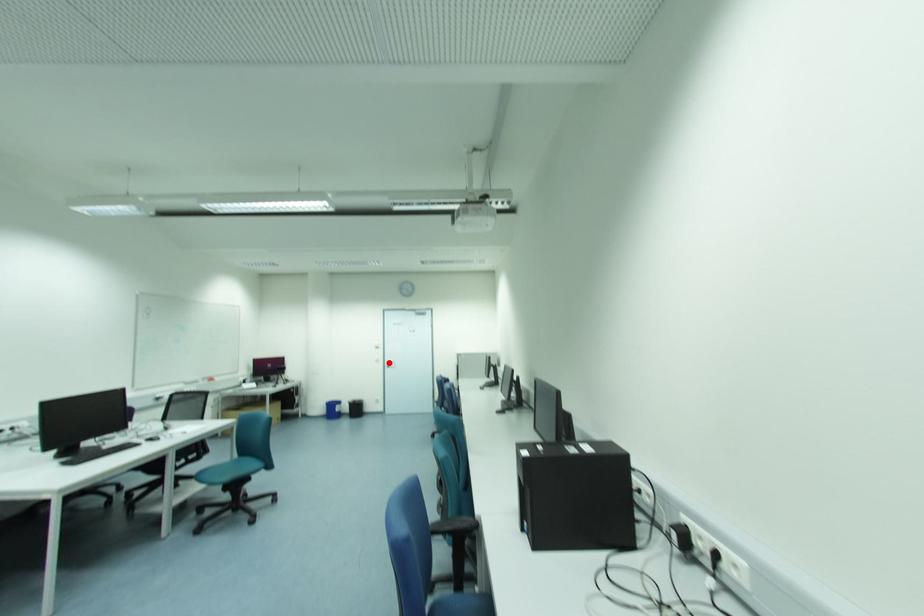
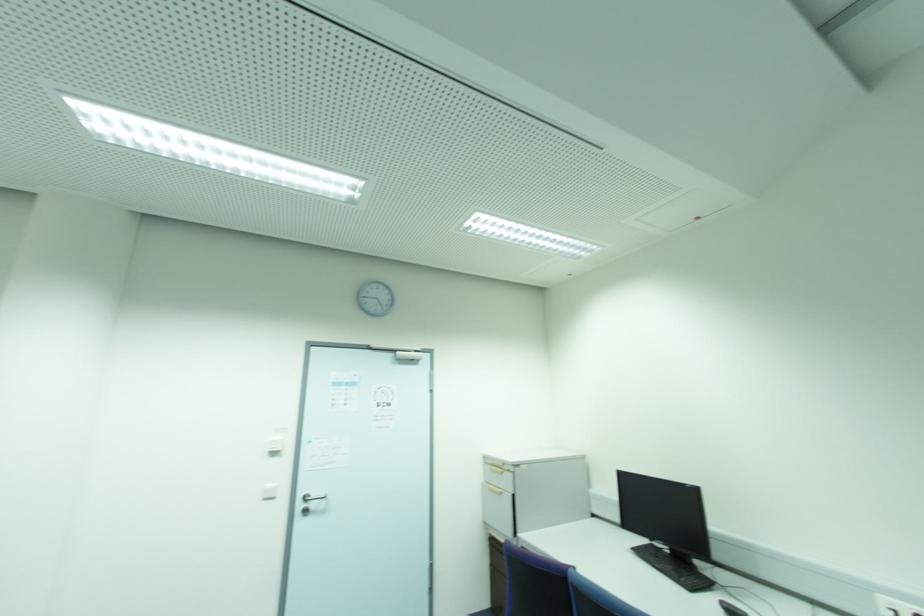
In the second image, find the point that corresponds to the highlighted location in the first image.

(306, 500)